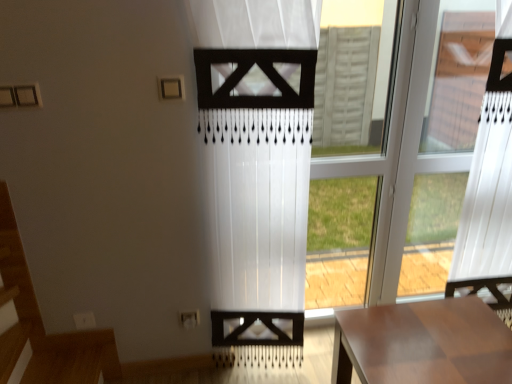
You are a GUI agent. You are given a task and a screenshot of the screen. Output one action in this format:
    pyautogui.click(x=<x>, y=<y>)
    Task: Click on the transparent glass window at center
    The width and height of the screenshot is (512, 384).
    Given the screenshot: What is the action you would take?
    pyautogui.click(x=349, y=173)

The image size is (512, 384). I want to click on white sheer curtain at center, so click(258, 167).

Considering the positions of objects wooden table at lower right and transparent glass window at center in the image provided, who is in front, wooden table at lower right or transparent glass window at center?

wooden table at lower right is more forward.

Is wooden table at lower right smaller than transparent glass window at center?

No, wooden table at lower right is not smaller than transparent glass window at center.

Is point (407, 322) in front of point (384, 146)?

Yes, it is.

Is transparent plastic window at right surrounded by white sheer curtain at center?

No, transparent plastic window at right is not a part of white sheer curtain at center.

Is point (217, 3) behind point (349, 174)?

That is False.

Based on the photo, is white sheer curtain at center not near transparent plastic window at right?

No, white sheer curtain at center is not far from transparent plastic window at right.

From a real-world perspective, is white sheer curtain at center on top of transparent plastic window at right?

No, from a real-world perspective, white sheer curtain at center is not over transparent plastic window at right

Which object is thinner, transparent plastic window at right or white sheer curtain at center?

white sheer curtain at center.

Between transparent plastic window at right and white sheer curtain at center, which one has more height?

white sheer curtain at center.

Considering the sizes of objects transparent plastic window at right and white sheer curtain at center in the image provided, who is smaller, transparent plastic window at right or white sheer curtain at center?

white sheer curtain at center.

Considering their positions, is wooden table at lower right located in front of or behind white sheer curtain at center?

In the image, wooden table at lower right appears behind white sheer curtain at center.

Would you say wooden table at lower right is inside or outside white sheer curtain at center?

wooden table at lower right is spatially situated outside white sheer curtain at center.

From the image's perspective, is wooden table at lower right above or below white sheer curtain at center?

Clearly, from the image's perspective, wooden table at lower right is below white sheer curtain at center.

Can you confirm if wooden table at lower right is wider than white sheer curtain at center?

Indeed, wooden table at lower right has a greater width compared to white sheer curtain at center.

Is transparent glass window at center at the back of white sheer curtain at center?

No, white sheer curtain at center is not facing away from transparent glass window at center.

Based on their positions, is white sheer curtain at center located to the left or right of transparent glass window at center?

white sheer curtain at center is to the left of transparent glass window at center.

The height and width of the screenshot is (384, 512). Identify the location of window frame below the white sheer curtain at center (from a real-world perspective). (349, 173).

Consider the image. What's the angular difference between white sheer curtain at center and transparent glass window at center's facing directions?

There is a 2.82-degree angle between the facing directions of white sheer curtain at center and transparent glass window at center.

Based on the photo, considering the sizes of white sheer curtain at center and wooden table at lower right in the image, is white sheer curtain at center taller or shorter than wooden table at lower right?

Considering their sizes, white sheer curtain at center has more height than wooden table at lower right.

Is white sheer curtain at center oriented away from wooden table at lower right?

No, wooden table at lower right is not at the back of white sheer curtain at center.

How much distance is there between white sheer curtain at center and wooden table at lower right?

They are 22.68 inches apart.

Based on their sizes in the image, would you say white sheer curtain at center is bigger or smaller than wooden table at lower right?

Clearly, white sheer curtain at center is smaller in size than wooden table at lower right.

In terms of height, does transparent glass window at center look taller or shorter compared to white sheer curtain at center?

Clearly, transparent glass window at center is taller compared to white sheer curtain at center.

From the image's perspective, relative to white sheer curtain at center, is transparent glass window at center above or below?

transparent glass window at center is situated higher than white sheer curtain at center in the image.

Looking at this image, considering the sizes of objects transparent glass window at center and white sheer curtain at center in the image provided, who is bigger, transparent glass window at center or white sheer curtain at center?

Bigger between the two is white sheer curtain at center.

How many degrees apart are the facing directions of transparent glass window at center and white sheer curtain at center?

2.82 degrees separate the facing orientations of transparent glass window at center and white sheer curtain at center.

What are the coordinates of `window frame behind the wooden table at lower right` in the screenshot? It's located at (349, 173).

This screenshot has height=384, width=512. Find the location of `window lying above the white sheer curtain at center (from the image's perspective)`. window lying above the white sheer curtain at center (from the image's perspective) is located at coordinates (399, 149).

Considering their positions, is wooden table at lower right positioned closer to transparent plastic window at right than white sheer curtain at center?

white sheer curtain at center lies closer to transparent plastic window at right than the other object.

Estimate the real-world distances between objects in this image. Which object is further from transparent glass window at center, transparent plastic window at right or wooden table at lower right?

Based on the image, wooden table at lower right appears to be further to transparent glass window at center.

When comparing their distances from white sheer curtain at center, does transparent plastic window at right or transparent glass window at center seem closer?

Among the two, transparent plastic window at right is located nearer to white sheer curtain at center.

From the image, which object appears to be nearer to transparent plastic window at right, transparent glass window at center or white sheer curtain at center?

transparent glass window at center is closer to transparent plastic window at right.

Considering their positions, is wooden table at lower right positioned further to transparent glass window at center than transparent plastic window at right?

Based on the image, wooden table at lower right appears to be further to transparent glass window at center.

Considering their positions, is transparent glass window at center positioned closer to transparent plastic window at right than wooden table at lower right?

Among the two, transparent glass window at center is located nearer to transparent plastic window at right.

When comparing their distances from wooden table at lower right, does transparent glass window at center or transparent plastic window at right seem closer?

transparent plastic window at right is positioned closer to the anchor wooden table at lower right.

From the image, which object appears to be farther from white sheer curtain at center, transparent glass window at center or transparent plastic window at right?

The object further to white sheer curtain at center is transparent glass window at center.

I want to click on window frame between white sheer curtain at center and transparent plastic window at right in the horizontal direction, so click(349, 173).

Where is `curtain between transparent glass window at center and wooden table at lower right vertically`? curtain between transparent glass window at center and wooden table at lower right vertically is located at coordinates (258, 167).

Locate an element on the screen. The width and height of the screenshot is (512, 384). table between white sheer curtain at center and transparent plastic window at right is located at coordinates (422, 343).

The image size is (512, 384). I want to click on window frame that lies between transparent plastic window at right and wooden table at lower right from top to bottom, so click(x=349, y=173).